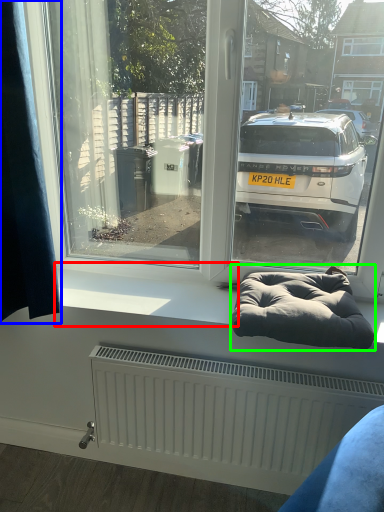
Question: Considering the real-world distances, which object is farthest from window sill (highlighted by a red box)? curtain (highlighted by a blue box) or bean bag chair (highlighted by a green box)?

Choices:
 (A) curtain
 (B) bean bag chair

Answer: (A)